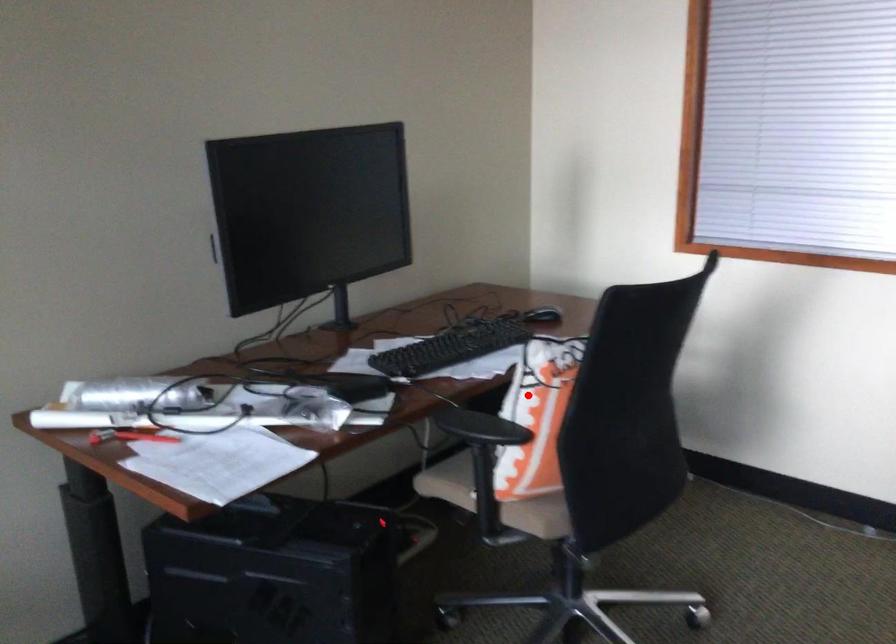
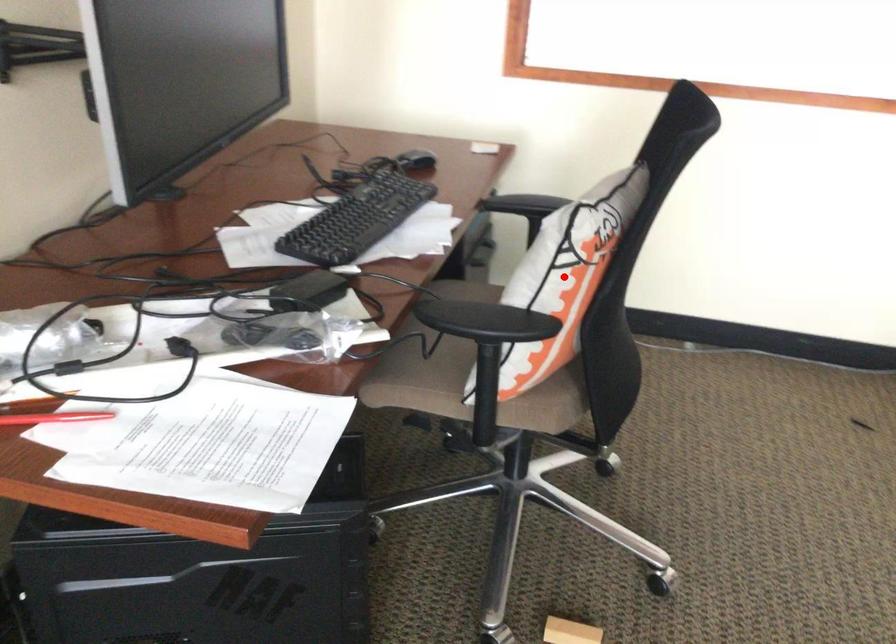
I am providing you with two images of the same scene from different viewpoints. A red point is marked on the first image and another point is marked on the second image. Does the point marked in image1 correspond to the same location as the one in image2?

Yes